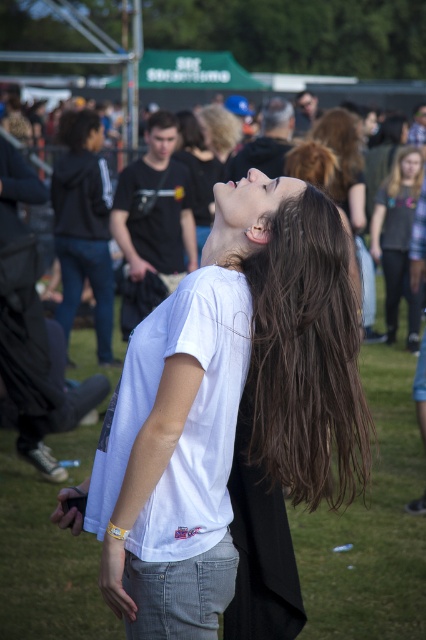
Is matte black jacket at right taller than smooth skin face at upper center?

Yes, matte black jacket at right is taller than smooth skin face at upper center.

Which is above, matte black jacket at right or smooth skin face at upper center?

smooth skin face at upper center is above.

This screenshot has width=426, height=640. Identify the location of matte black jacket at right. (397, 246).

Between point (262, 369) and point (213, 188), which one is positioned in front?

Point (262, 369)

Which of these two, brown silky hair at center or smooth skin face at center, stands shorter?

smooth skin face at center

Between point (305, 452) and point (249, 180), which one is positioned behind?

Point (249, 180)

What are the coordinates of `brown silky hair at center` in the screenshot? It's located at (305, 356).

Between matte black jacket at right and brown straight hair at upper right, which one is positioned higher?

Positioned higher is brown straight hair at upper right.

Who is more forward, (399, 177) or (399, 173)?

Point (399, 177)

Describe the element at coordinates (397, 246) in the screenshot. I see `matte black jacket at right` at that location.

What are the coordinates of `matte black jacket at right` in the screenshot? It's located at (397, 246).